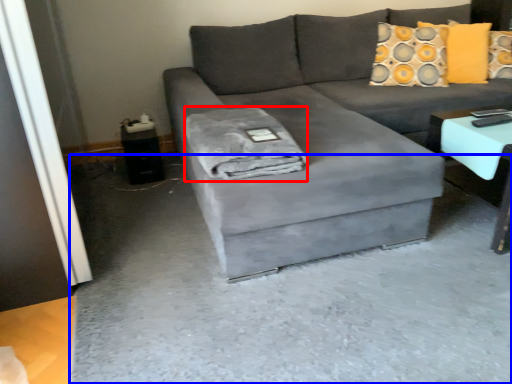
Question: Which object is closer to the camera taking this photo, material (highlighted by a red box) or concrete (highlighted by a blue box)?

Choices:
 (A) material
 (B) concrete

Answer: (B)